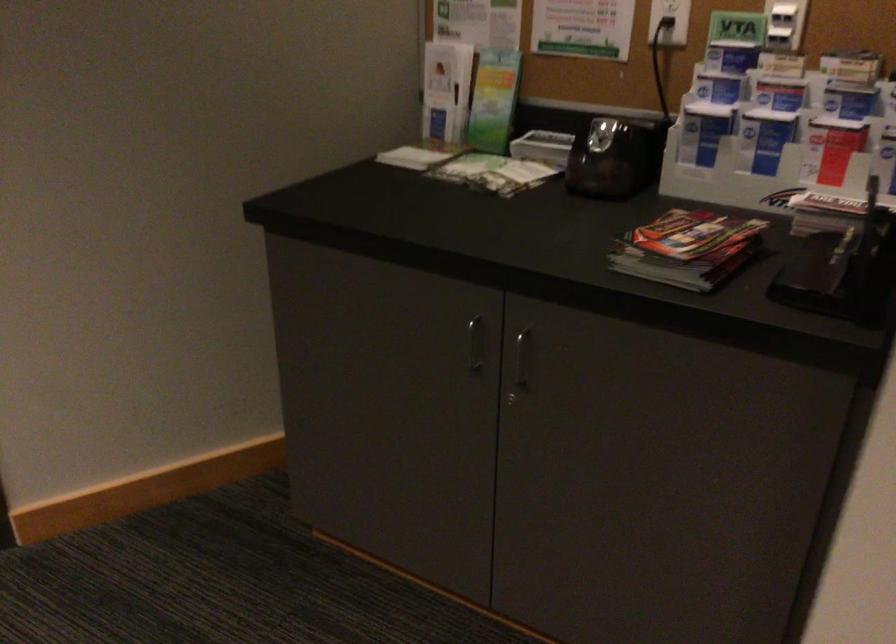
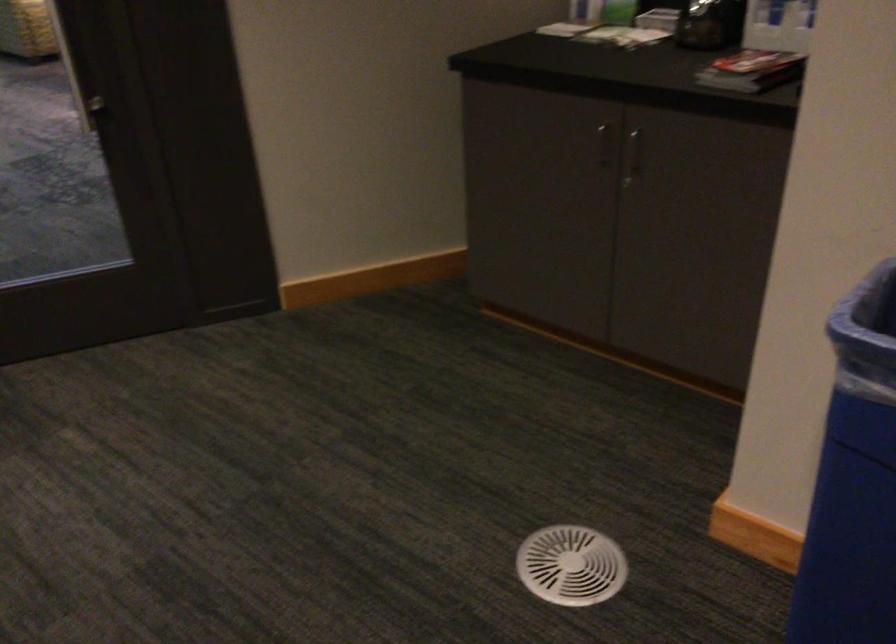
Question: The camera is either moving clockwise (left) or counter-clockwise (right) around the object. The first image is from the beginning of the video and the second image is from the end. Is the camera moving left or right when shooting the video?

Choices:
 (A) Left
 (B) Right

Answer: (B)